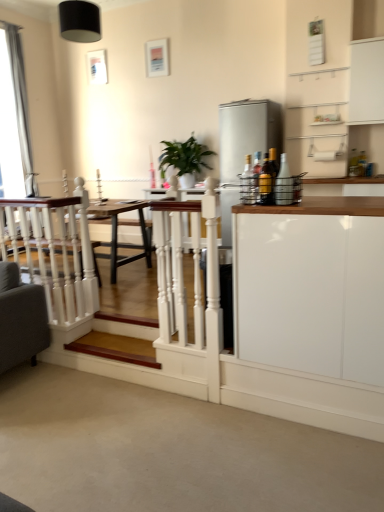
This screenshot has height=512, width=384. In order to click on free space that is to the left of translucent glass bottle at right, the first bottle when ordered from right to left in this screenshot , I will do `click(260, 204)`.